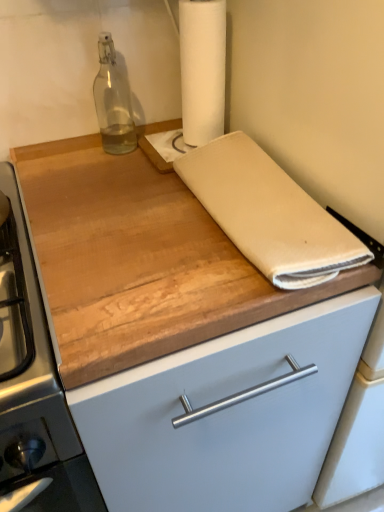
At what (x,y) coordinates should I click in order to perform the action: click on free space to the left of transparent glass bottle at upper left. Please return your answer as a coordinate pair (x, y). This screenshot has width=384, height=512. Looking at the image, I should click on (61, 152).